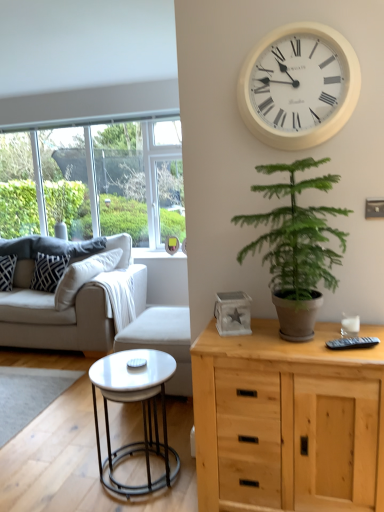
Find the location of a particular element. The height and width of the screenshot is (512, 384). free space that is in between green leafy plant at center-right and black plastic remote at right is located at coordinates coord(361,349).